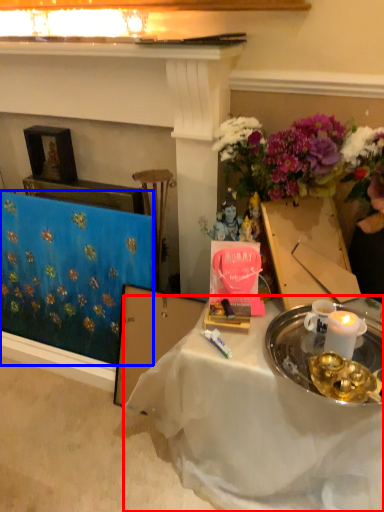
Question: Which of the following is the closest to the observer, desk (highlighted by a red box) or tablecloth (highlighted by a blue box)?

Choices:
 (A) desk
 (B) tablecloth

Answer: (A)